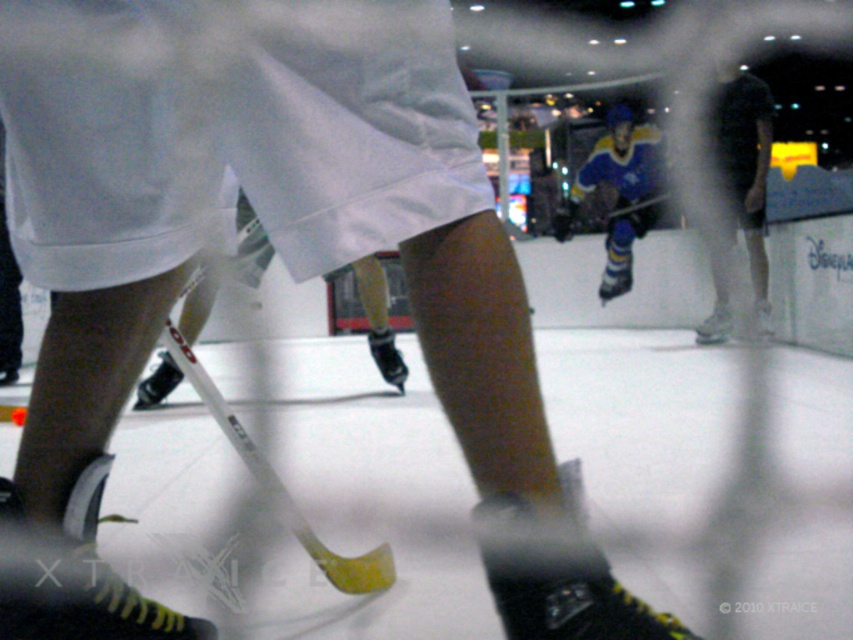
Question: Which point is closer to the camera?

Choices:
 (A) blue/yellow jersey at center
 (B) dark blue jersey at upper center

Answer: (B)

Question: Is dark blue jersey at upper center smaller than blue/yellow jersey at center?

Choices:
 (A) yes
 (B) no

Answer: (A)

Question: From the image, what is the correct spatial relationship of dark blue jersey at upper center in relation to blue/yellow jersey at center?

Choices:
 (A) right
 (B) left

Answer: (A)

Question: Which point is farther to the camera?

Choices:
 (A) (734, 211)
 (B) (625, 244)

Answer: (B)

Question: Where is dark blue jersey at upper center located in relation to blue/yellow jersey at center in the image?

Choices:
 (A) below
 (B) above

Answer: (A)

Question: Which point is farther to the camera?

Choices:
 (A) [769, 120]
 (B) [608, 182]

Answer: (B)